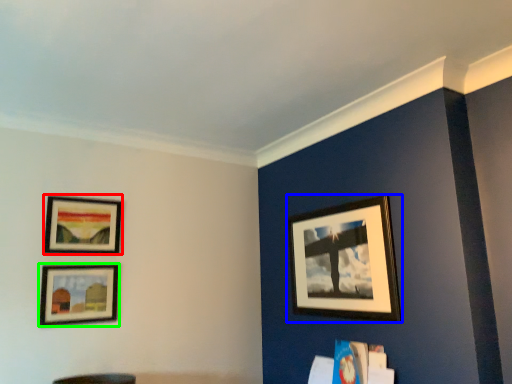
Question: Estimate the real-world distances between objects in this image. Which object is farther from picture frame (highlighted by a red box), picture frame (highlighted by a blue box) or picture frame (highlighted by a green box)?

Choices:
 (A) picture frame
 (B) picture frame

Answer: (A)